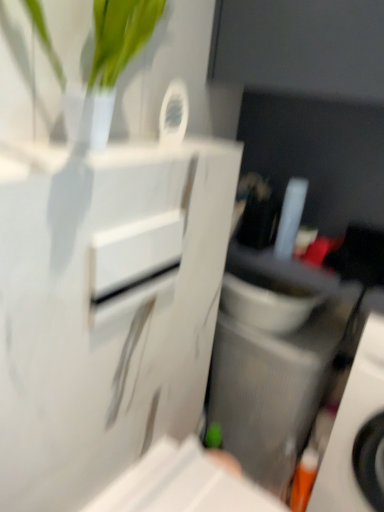
Question: From a real-world perspective, is orange plastic toothbrush at lower right physically located above or below white glossy drawer at center?

Choices:
 (A) below
 (B) above

Answer: (A)

Question: Does point (347, 399) appear closer or farther from the camera than point (120, 286)?

Choices:
 (A) farther
 (B) closer

Answer: (A)

Question: Which object is positioned farthest from the orange plastic toothbrush at lower right?

Choices:
 (A) white glossy drawer at center
 (B) gray textured speaker at lower right

Answer: (A)

Question: Which of these objects is positioned closest to the gray textured speaker at lower right?

Choices:
 (A) orange plastic toothbrush at lower right
 (B) white glossy drawer at center

Answer: (A)